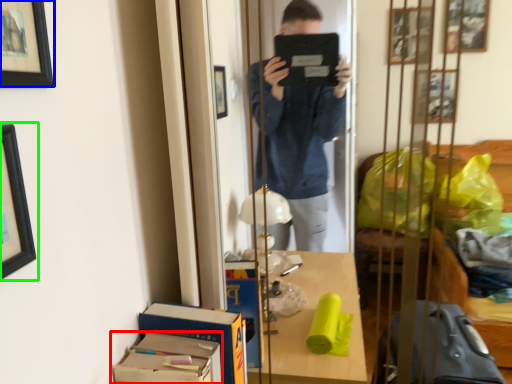
Question: Which object is positioned farthest from cardboard box (highlighted by a red box)? Select from picture frame (highlighted by a blue box) and picture frame (highlighted by a green box).

Choices:
 (A) picture frame
 (B) picture frame

Answer: (A)